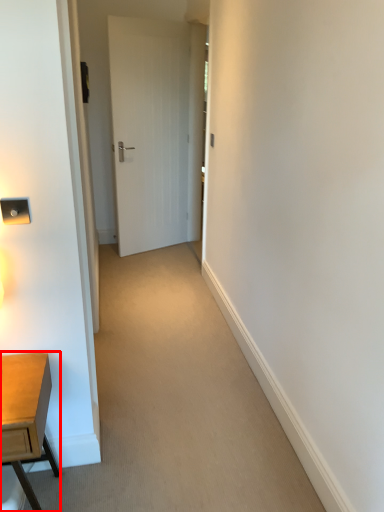
Question: From the image's perspective, where is desk (annotated by the red box) located in relation to door in the image?

Choices:
 (A) above
 (B) below

Answer: (B)